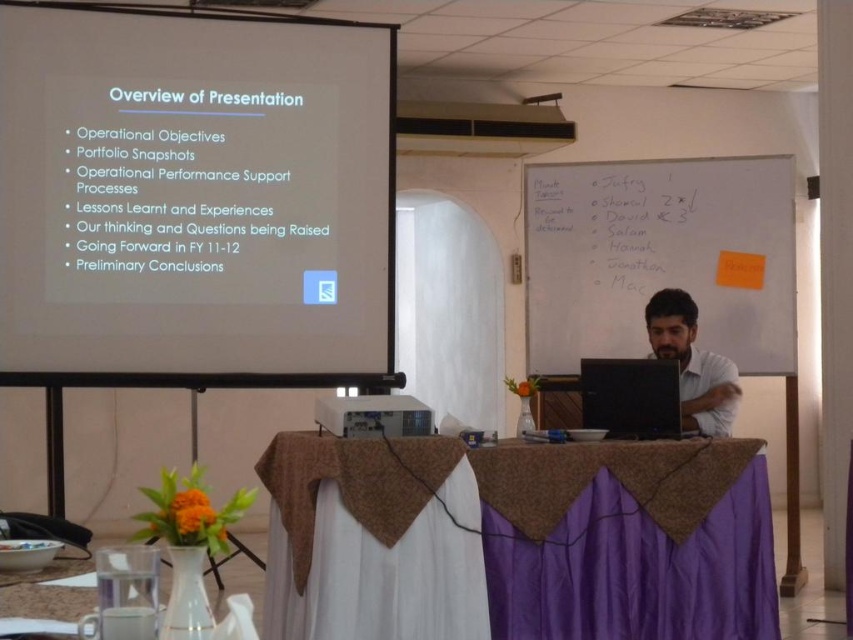
You are setting up for a presentation and need to decide which surface to use for a larger visual display. Based on the scene, which object between the white matte projector screen at upper center and the whiteboard at upper right would be more suitable for showing a large presentation slide?

The white matte projector screen at upper center has a larger width than the whiteboard at upper right, making it more suitable for showing a large presentation slide.

You are an event organizer preparing for a presentation. You need to decide where to place a 2m tall banner. The banner must be placed on either the white matte projector screen at upper center or the whiteboard at upper right. Which object can accommodate the banner without the need for folding or cutting?

The white matte projector screen at upper center is much taller than the whiteboard at upper right, so the banner can be placed on the white matte projector screen at upper center without folding or cutting.